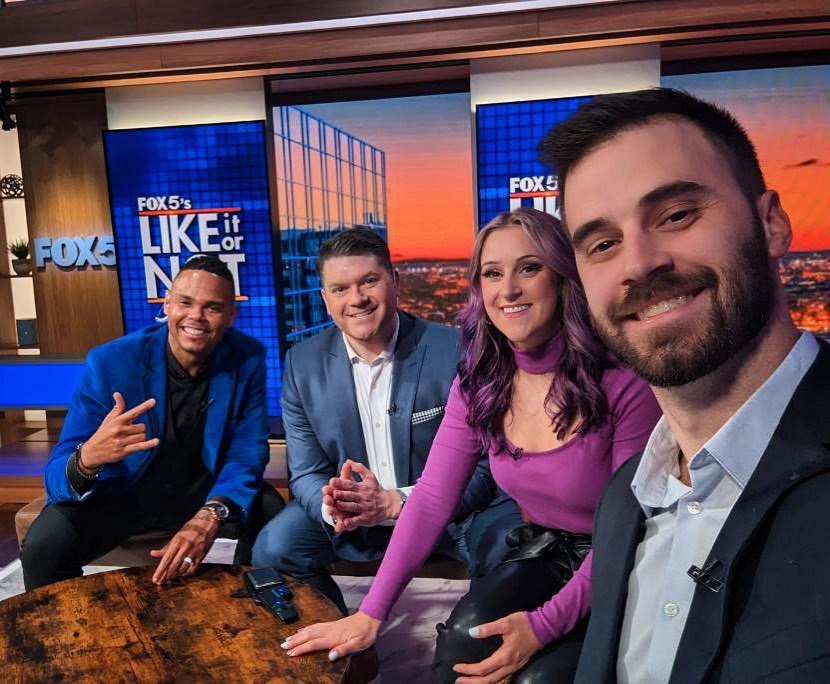
Where is `wooden bench`? The height and width of the screenshot is (684, 830). wooden bench is located at coordinates (28, 518).